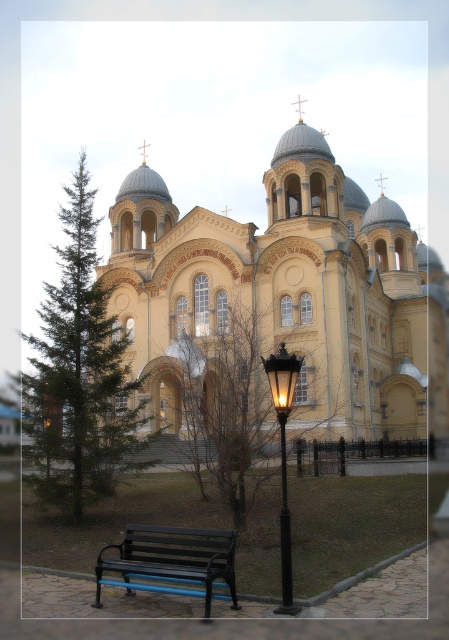
Which is below, black metal bench at lower left or black glass lamp post at center?

Positioned lower is black metal bench at lower left.

Can you confirm if black metal bench at lower left is smaller than black glass lamp post at center?

Correct, black metal bench at lower left occupies less space than black glass lamp post at center.

Locate an element on the screen. This screenshot has width=449, height=640. black metal bench at lower left is located at coordinates (172, 561).

Locate an element on the screen. This screenshot has width=449, height=640. black metal bench at lower left is located at coordinates (172, 561).

Is yellow stone church at center above black glass lamp post at center?

Yes, yellow stone church at center is above black glass lamp post at center.

Who is more forward, (155, 355) or (294, 378)?

Point (294, 378) is more forward.

Is point (410, 336) closer to viewer compared to point (291, 604)?

No.

Where is `yellow stone church at center`? This screenshot has width=449, height=640. yellow stone church at center is located at coordinates (285, 289).

What do you see at coordinates (79, 374) in the screenshot? This screenshot has width=449, height=640. I see `green needle-like tree at left` at bounding box center [79, 374].

Is green needle-like tree at left above black metal bench at lower left?

Yes.

Describe the element at coordinates (79, 374) in the screenshot. I see `green needle-like tree at left` at that location.

What are the coordinates of `green needle-like tree at left` in the screenshot? It's located at point(79,374).